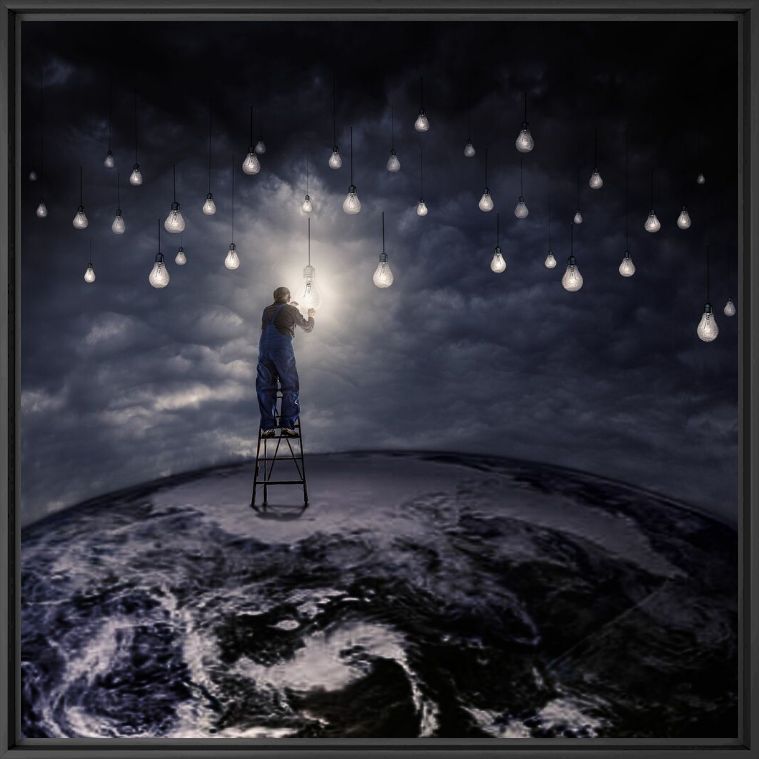
Find the location of a particular element. The height and width of the screenshot is (759, 759). ladder is located at coordinates (265, 482).